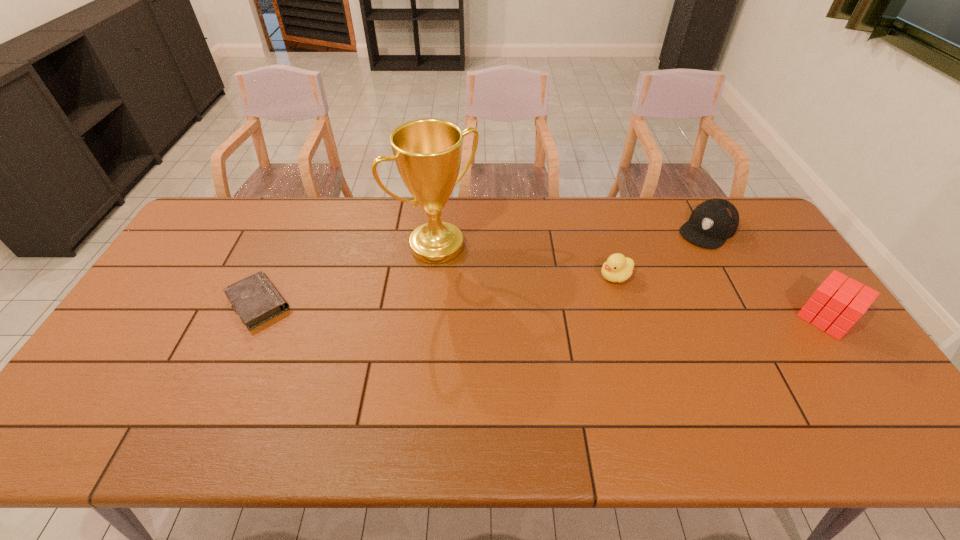
The height and width of the screenshot is (540, 960). What are the coordinates of `cube that is at the right edge` in the screenshot? It's located at pyautogui.click(x=842, y=306).

This screenshot has width=960, height=540. I want to click on cap situated at the right edge, so click(x=712, y=222).

The width and height of the screenshot is (960, 540). Identify the location of object at the far right corner. (712, 222).

This screenshot has height=540, width=960. What are the coordinates of `vacant space at the far edge of the desktop` in the screenshot? It's located at (349, 197).

The image size is (960, 540). I want to click on vacant space at the near edge of the desktop, so click(x=484, y=398).

Where is `free point at the left edge`? This screenshot has width=960, height=540. free point at the left edge is located at coordinates (161, 281).

In the image, there is a desktop. What are the coordinates of `vacant space at the right edge` in the screenshot? It's located at (798, 289).

In the image, there is a desktop. Where is `vacant space at the far right corner`? vacant space at the far right corner is located at coordinates (733, 238).

Locate an element on the screen. vacant space that is in between the cap and the duckling is located at coordinates (661, 253).

This screenshot has height=540, width=960. I want to click on free spot between the shortest object and the award, so click(348, 274).